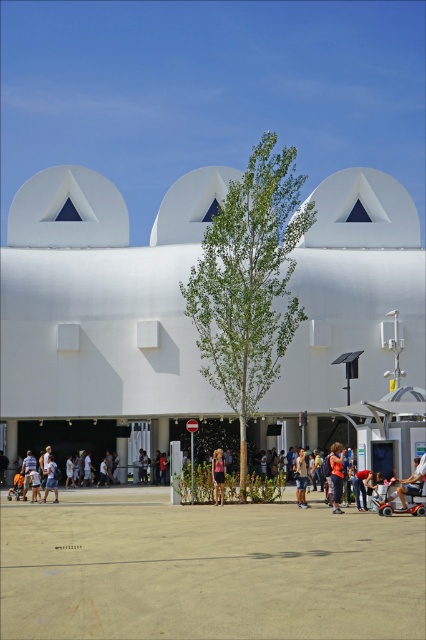
You are a photographer planning to take a photo of the denim shorts at center and the pink fabric dress at center. You want to ensure both items are in focus. Given that your camera has a depth of field that can cover 4 meters, will both items be in focus?

The denim shorts at center and the pink fabric dress at center are 3.84 meters apart. Since the distance between them is less than the 4 meter depth of field, both items will be in focus.

You are standing in front of the modern architectural structure and see the denim shorts at center and the pink fabric dress at center. Which one is taller?

The denim shorts at center is taller than the pink fabric dress at center.